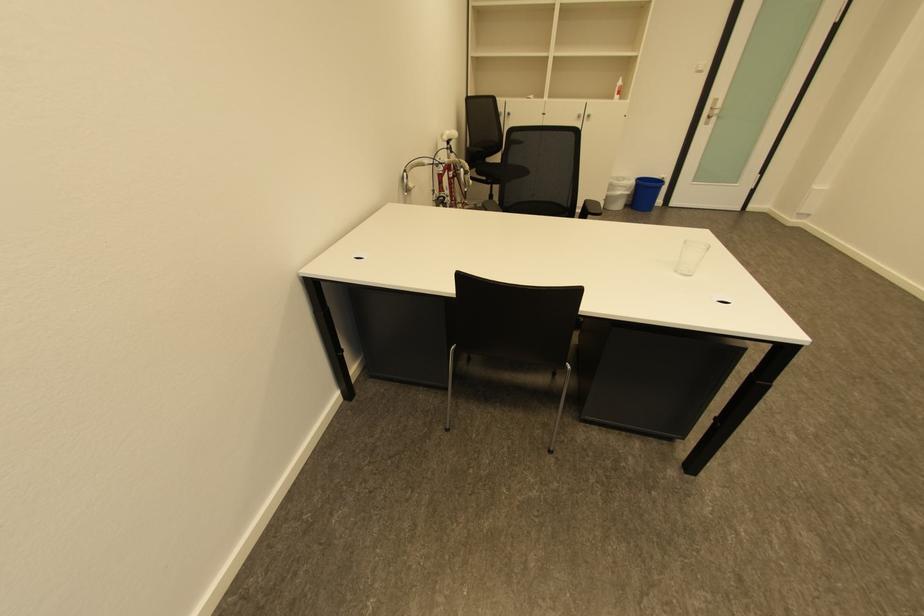
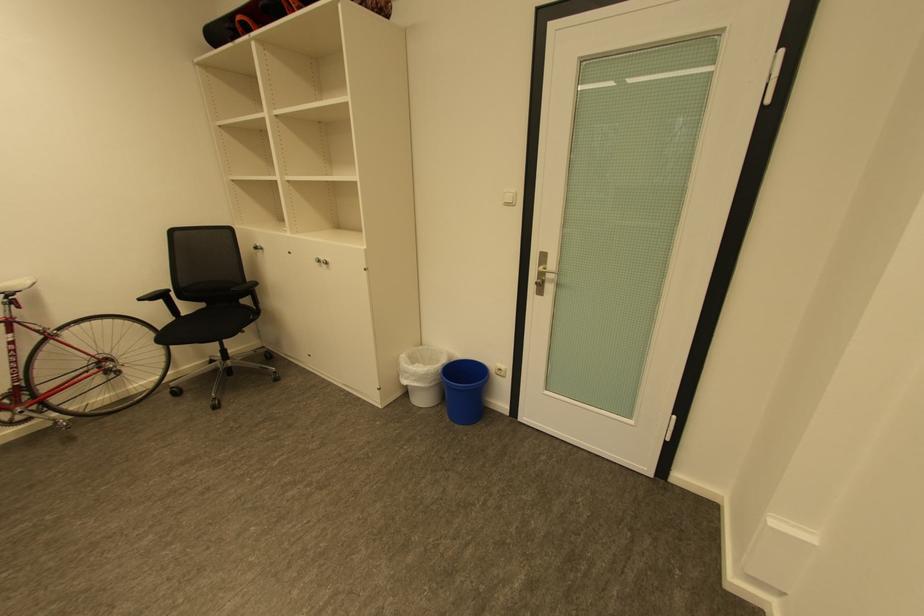
Find the pixel in the second image that matches the point at 626,188 in the first image.

(414, 373)